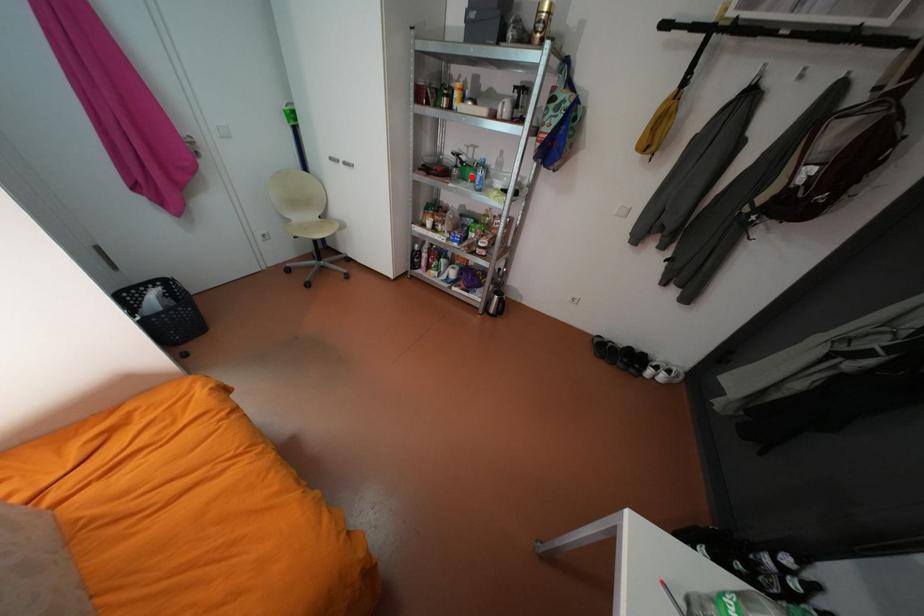
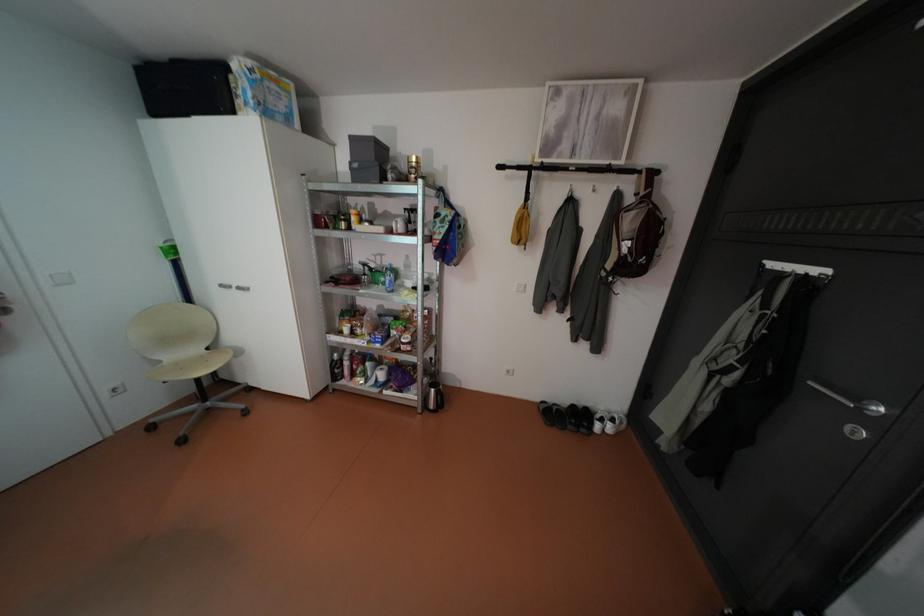
Question: I am providing you with two images of the same scene from different viewpoints. In image1, a red point is highlighted. Considering the same 3D point in image2, which of the following is correct?

Choices:
 (A) It is closer
 (B) It is farther

Answer: (B)